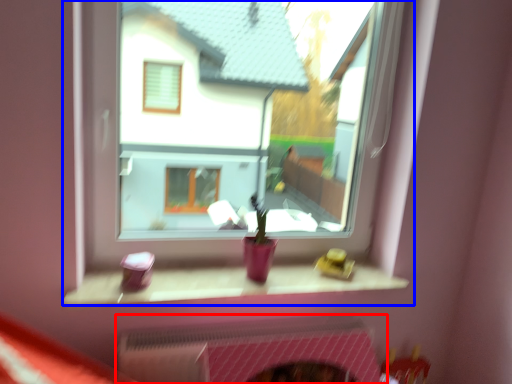
Question: Which of the following is the farthest to the observer, fireplace (highlighted by a red box) or window (highlighted by a blue box)?

Choices:
 (A) fireplace
 (B) window

Answer: (A)